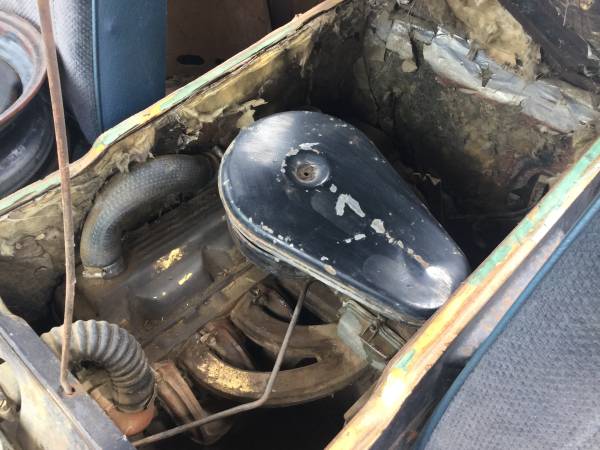
Find the location of a particular element. The width and height of the screenshot is (600, 450). metal bracket is located at coordinates (262, 397).